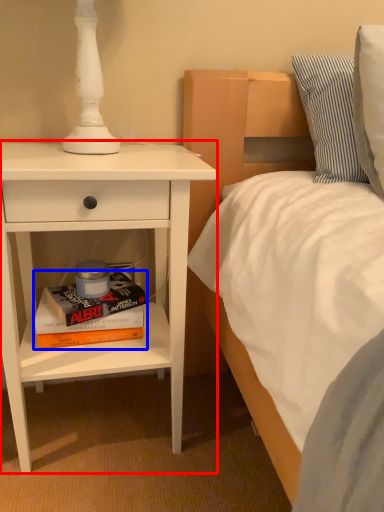
Question: Which object is further to the camera taking this photo, nightstand (highlighted by a red box) or book (highlighted by a blue box)?

Choices:
 (A) nightstand
 (B) book

Answer: (B)